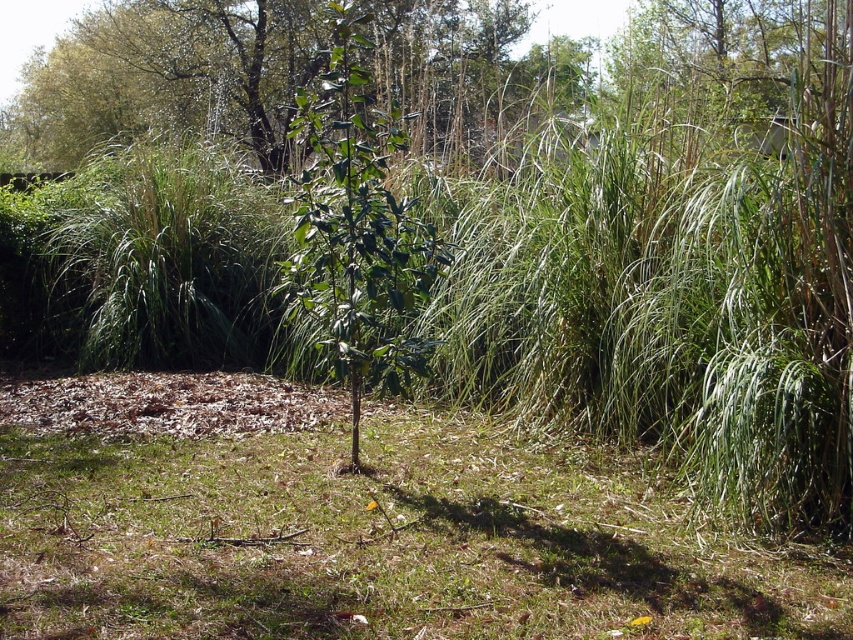
Question: Estimate the real-world distances between objects in this image. Which object is farther from the green leafy plant at upper center?

Choices:
 (A) green grass at center
 (B) green glossy leafy plant at center

Answer: (B)

Question: Is green grass at center above green leafy plant at upper center?

Choices:
 (A) no
 (B) yes

Answer: (A)

Question: Does green grass at center appear on the left side of green leafy plant at upper center?

Choices:
 (A) no
 (B) yes

Answer: (A)

Question: Which object is farther from the camera taking this photo?

Choices:
 (A) green grass at center
 (B) green glossy leafy plant at center
 (C) green leafy plant at upper center

Answer: (C)

Question: Which object appears farthest from the camera in this image?

Choices:
 (A) green glossy leafy plant at center
 (B) green grass at center

Answer: (B)

Question: Is green leafy plant at upper center to the right of green glossy leafy plant at center from the viewer's perspective?

Choices:
 (A) yes
 (B) no

Answer: (B)